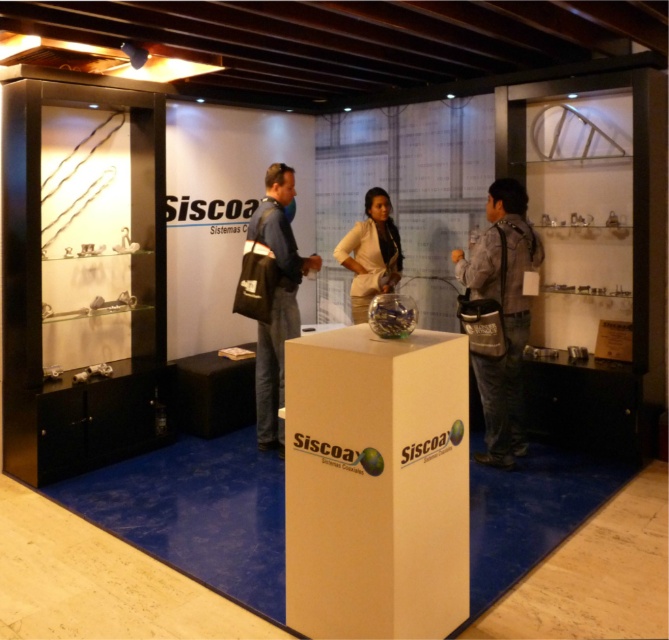
Question: Is gray fabric bag at right thinner than beige fabric jacket at center?

Choices:
 (A) no
 (B) yes

Answer: (A)

Question: Is gray fabric bag at right to the left of dark blue fabric jacket at center from the viewer's perspective?

Choices:
 (A) yes
 (B) no

Answer: (B)

Question: Which object is farther from the camera taking this photo?

Choices:
 (A) gray fabric bag at right
 (B) dark blue fabric jacket at center

Answer: (B)

Question: Does dark blue fabric jacket at center have a larger size compared to beige fabric jacket at center?

Choices:
 (A) yes
 (B) no

Answer: (A)

Question: Which object is farther from the camera taking this photo?

Choices:
 (A) dark blue fabric jacket at center
 (B) beige fabric jacket at center

Answer: (B)

Question: Based on their relative distances, which object is farther from the beige fabric jacket at center?

Choices:
 (A) gray fabric bag at right
 (B) dark blue fabric jacket at center

Answer: (A)